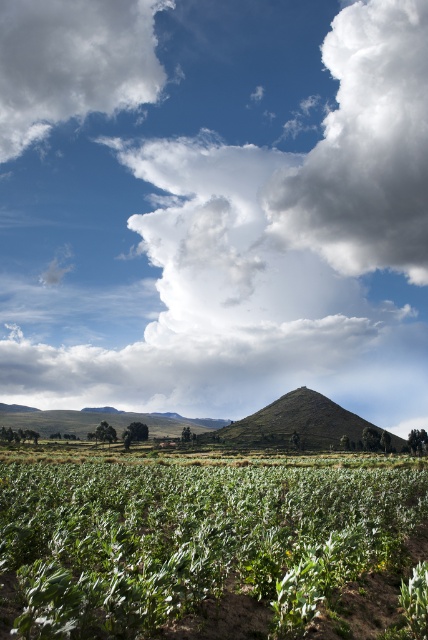
Question: Estimate the real-world distances between objects in this image. Which object is farther from the green grassy hill at center?

Choices:
 (A) white fluffy cloud at upper right
 (B) white fluffy cloud at upper left
 (C) green leafy plants at lower left
 (D) white fluffy cloud at upper center

Answer: (B)

Question: Which object is closer to the camera taking this photo?

Choices:
 (A) white fluffy cloud at upper left
 (B) white fluffy cloud at upper right

Answer: (B)

Question: Does white fluffy cloud at upper right appear under white fluffy cloud at upper left?

Choices:
 (A) no
 (B) yes

Answer: (B)

Question: Which object is farther from the camera taking this photo?

Choices:
 (A) green leafy plants at lower left
 (B) white fluffy cloud at upper right
 (C) white fluffy cloud at upper left

Answer: (C)

Question: Can you confirm if white fluffy cloud at upper center is positioned to the left of green grassy hill at center?

Choices:
 (A) no
 (B) yes

Answer: (B)

Question: Where is green leafy plants at lower left located in relation to white fluffy cloud at upper right in the image?

Choices:
 (A) above
 (B) below

Answer: (B)